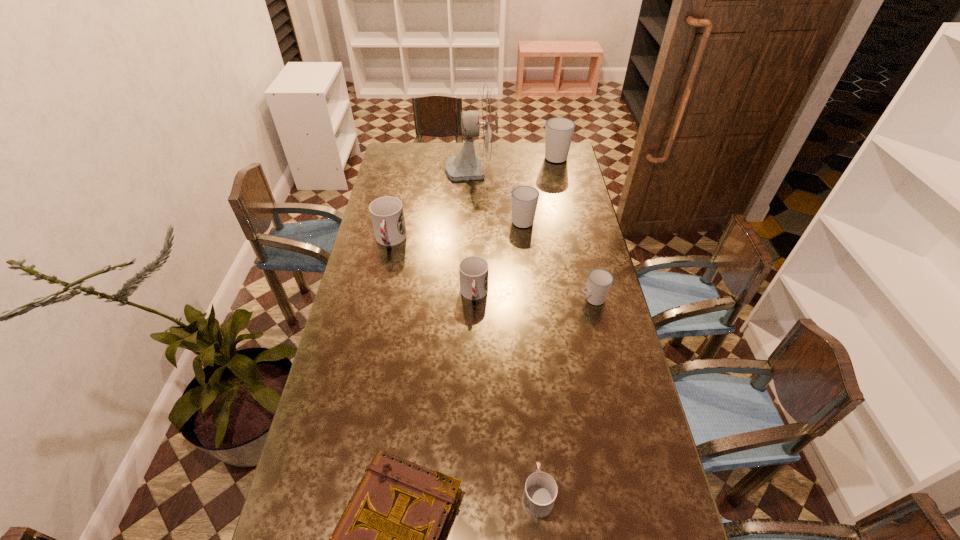
Find the location of `vacant space at the left edge of the desktop`. vacant space at the left edge of the desktop is located at coordinates (372, 330).

You are a GUI agent. You are given a task and a screenshot of the screen. Output one action in this format:
    pyautogui.click(x=<x>, y=<y>)
    Task: Click on the free region at the right edge
    The width and height of the screenshot is (960, 540).
    Given the screenshot: What is the action you would take?
    coord(584,339)

The width and height of the screenshot is (960, 540). In order to click on free location at the far left corner in this screenshot , I will do tap(416, 161).

Locate an element on the screen. free space between the leftmost white cup and the fan is located at coordinates (496, 194).

Where is `vacant area that lies between the smallest white cup and the leftmost cup`? This screenshot has height=540, width=960. vacant area that lies between the smallest white cup and the leftmost cup is located at coordinates (492, 269).

Identify the location of free space between the biggest white cup and the nearest white cup. This screenshot has width=960, height=540. pos(574,227).

This screenshot has height=540, width=960. Identify the location of empty space that is in between the second farthest white cup and the fan. (496, 194).

Locate an element on the screen. free spot between the second red cup from right to left and the second farthest white cup is located at coordinates (498, 257).

I want to click on free point between the second biggest white cup and the nearest white cup, so click(558, 260).

This screenshot has width=960, height=540. I want to click on vacant point located between the fifth cup from right to left and the farthest red cup, so click(432, 267).